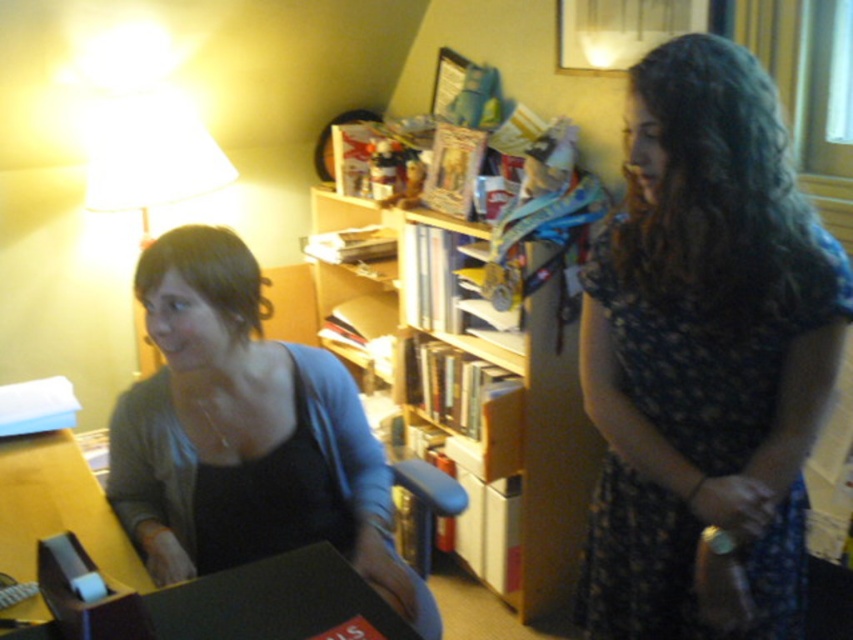
Question: Which point is closer to the camera taking this photo?

Choices:
 (A) (158, 340)
 (B) (746, 586)
 (C) (387, 374)

Answer: (B)

Question: Which object is closer to the camera taking this photo?

Choices:
 (A) matte black shirt at left
 (B) dark floral dress at right

Answer: (B)

Question: Is dark floral dress at right below wooden bookshelf at center?

Choices:
 (A) no
 (B) yes

Answer: (B)

Question: Among these objects, which one is farthest from the camera?

Choices:
 (A) dark floral dress at right
 (B) wooden bookshelf at center

Answer: (B)

Question: Can you confirm if dark floral dress at right is positioned to the left of matte black shirt at left?

Choices:
 (A) yes
 (B) no

Answer: (B)

Question: Is dark floral dress at right bigger than wooden bookshelf at center?

Choices:
 (A) no
 (B) yes

Answer: (A)